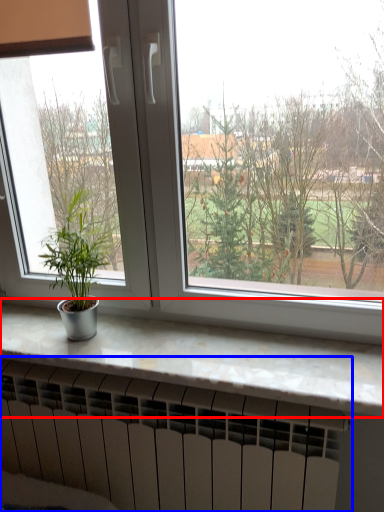
Question: Among these objects, which one is nearest to the camera, counter top (highlighted by a red box) or heater (highlighted by a blue box)?

Choices:
 (A) counter top
 (B) heater

Answer: (A)